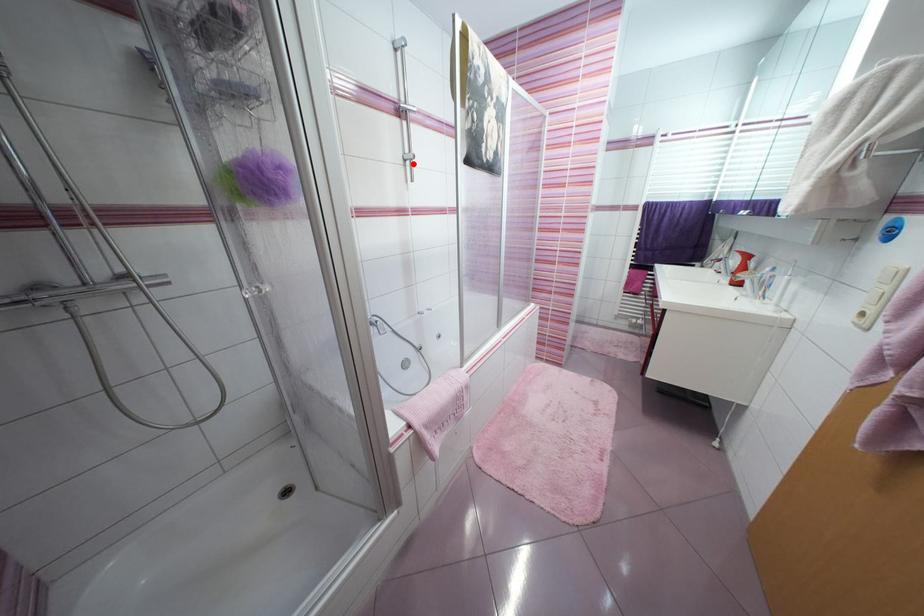
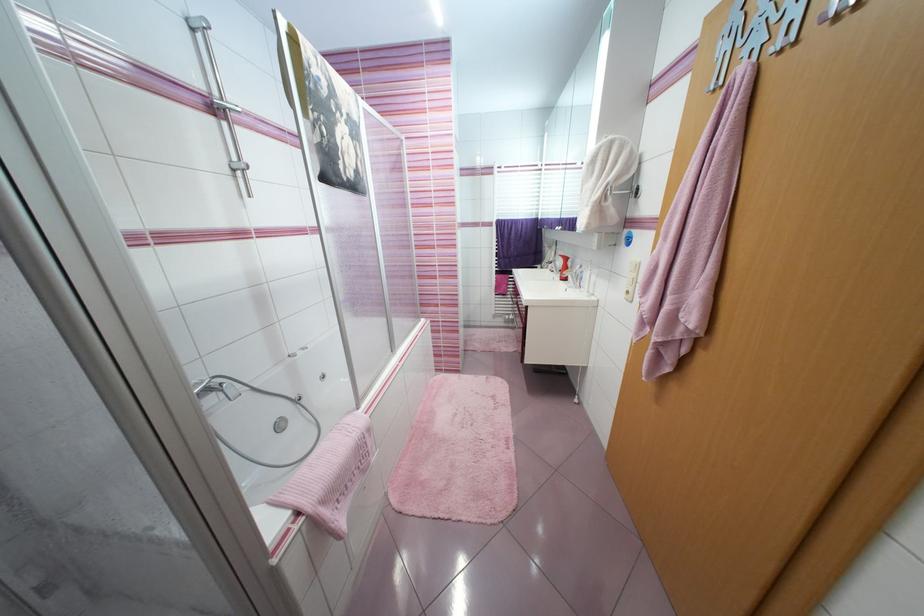
Where in the second image is the point corresponding to the highlighted location from the first image?

(245, 175)